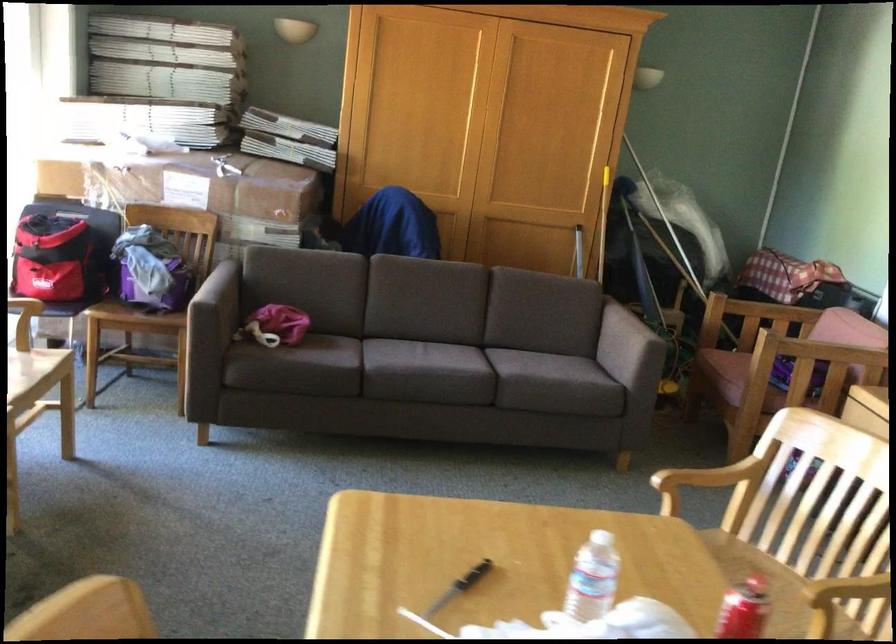
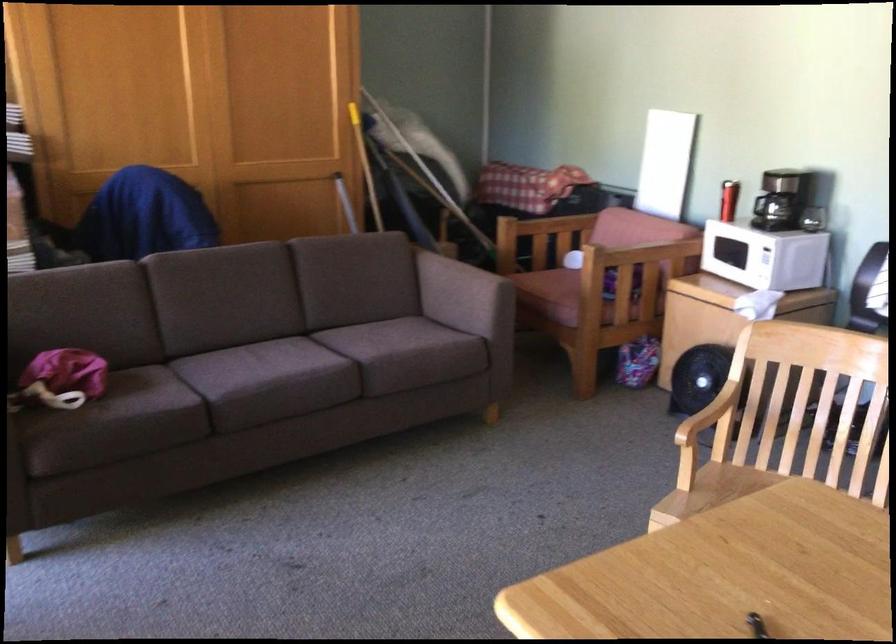
Question: Based on the continuous images, in which direction is the camera rotating? Reply with the corresponding letter.

Choices:
 (A) Left
 (B) Right
 (C) Up
 (D) Down

Answer: (B)